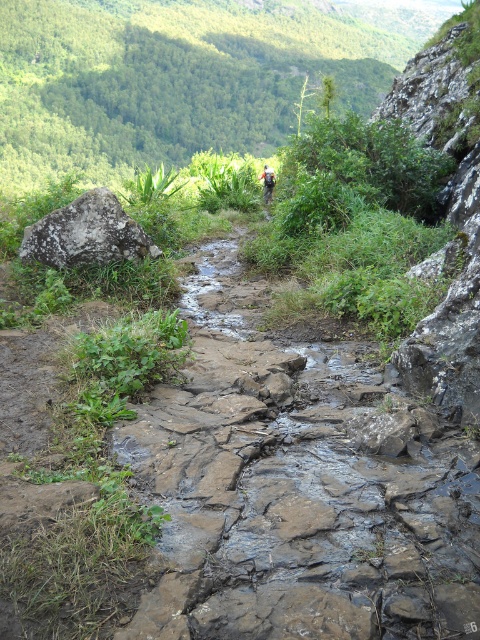
Question: Which point is closer to the camera?

Choices:
 (A) camouflage fabric backpack at center
 (B) wet stone trail at center
 (C) gray rough rock at left

Answer: (B)

Question: Estimate the real-world distances between objects in this image. Which object is closer to the gray rough rock at left?

Choices:
 (A) camouflage fabric backpack at center
 (B) wet stone trail at center

Answer: (B)

Question: From the image, what is the correct spatial relationship of wet stone trail at center in relation to camouflage fabric backpack at center?

Choices:
 (A) above
 (B) below

Answer: (B)

Question: Which of the following is the closest to the observer?

Choices:
 (A) (340, 394)
 (B) (264, 202)
 (C) (72, 266)

Answer: (A)

Question: Is gray rough rock at left further to the viewer compared to camouflage fabric backpack at center?

Choices:
 (A) yes
 (B) no

Answer: (B)

Question: Can you confirm if gray rough rock at left is wider than camouflage fabric backpack at center?

Choices:
 (A) yes
 (B) no

Answer: (A)